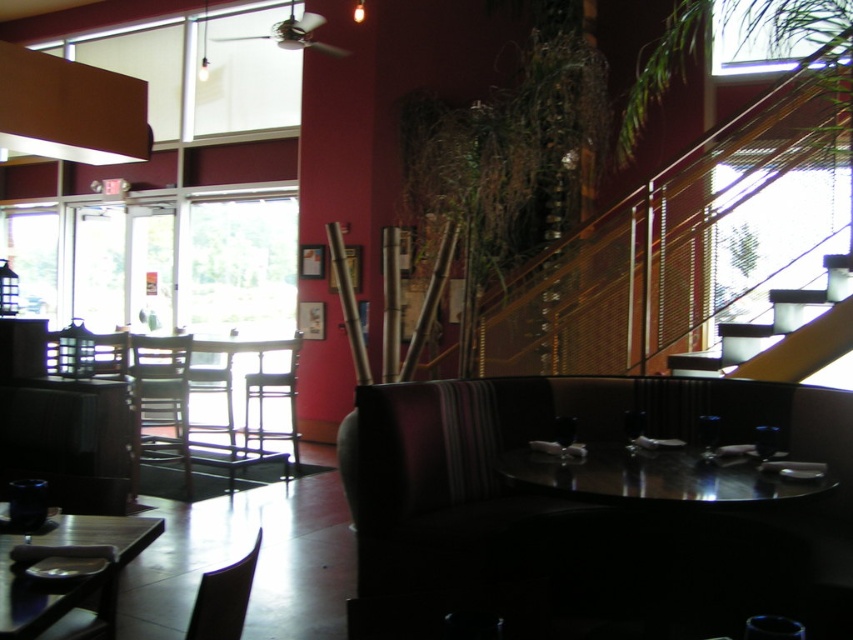
Between glossy black table at center and brown wooden chair at left, which one has less height?

With less height is glossy black table at center.

Between glossy black table at center and brown wooden chair at left, which one is positioned higher?

Positioned higher is glossy black table at center.

What do you see at coordinates (664, 474) in the screenshot?
I see `glossy black table at center` at bounding box center [664, 474].

The image size is (853, 640). I want to click on glossy black table at center, so point(664,474).

Is point (125, 520) less distant than point (114, 376)?

Yes, point (125, 520) is in front of point (114, 376).

Who is positioned more to the right, wooden table at lower left or wooden chair at left?

Positioned to the right is wooden table at lower left.

Find the location of a particular element. wooden table at lower left is located at coordinates (67, 577).

Is glossy black table at center smaller than wooden table at lower left?

Yes.

Is glossy black table at center to the right of wooden table at lower left from the viewer's perspective?

→ Correct, you'll find glossy black table at center to the right of wooden table at lower left.

Measure the distance between glossy black table at center and camera.

6.82 feet

Locate an element on the screen. Image resolution: width=853 pixels, height=640 pixels. glossy black table at center is located at coordinates (664, 474).